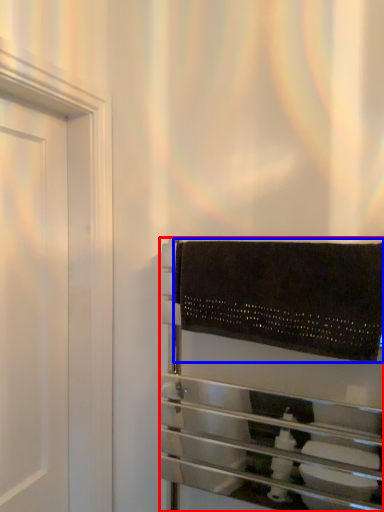
Question: Which of the following is the farthest to the observer, towel rack (highlighted by a red box) or bath towel (highlighted by a blue box)?

Choices:
 (A) towel rack
 (B) bath towel

Answer: (B)